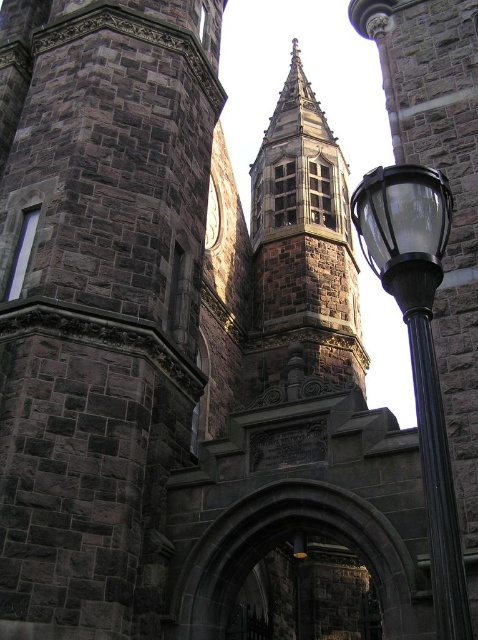
Between brown stone church tower at center and dark stone archway at center, which one is positioned lower?

dark stone archway at center is lower down.

Who is positioned more to the right, brown stone church tower at center or dark stone archway at center?

Positioned to the right is brown stone church tower at center.

Where is `brown stone church tower at center`? brown stone church tower at center is located at coordinates (303, 244).

Image resolution: width=478 pixels, height=640 pixels. I want to click on brown stone church tower at center, so click(x=303, y=244).

Between dark gray stone tower at center and black polished metal street light at right, which one has less height?

With less height is black polished metal street light at right.

Can you confirm if dark gray stone tower at center is positioned to the left of black polished metal street light at right?

Correct, you'll find dark gray stone tower at center to the left of black polished metal street light at right.

The height and width of the screenshot is (640, 478). I want to click on dark gray stone tower at center, so click(x=98, y=300).

This screenshot has height=640, width=478. I want to click on dark gray stone tower at center, so click(x=98, y=300).

Identify the location of dark gray stone tower at center. The image size is (478, 640). (98, 300).

Does dark gray stone tower at center appear on the right side of matte gray clock at upper center?

No, dark gray stone tower at center is not to the right of matte gray clock at upper center.

The height and width of the screenshot is (640, 478). Describe the element at coordinates (98, 300) in the screenshot. I see `dark gray stone tower at center` at that location.

The width and height of the screenshot is (478, 640). Identify the location of dark gray stone tower at center. (98, 300).